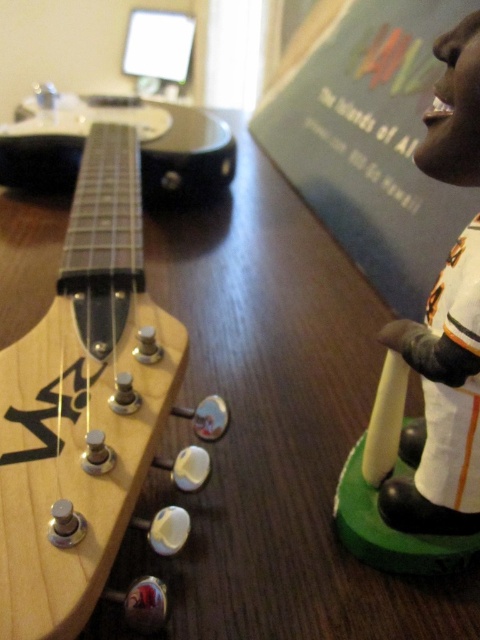
Question: Is the position of natural wood guitar headstock at center-left less distant than that of white plastic bobblehead at right?

Choices:
 (A) no
 (B) yes

Answer: (B)

Question: Is the position of natural wood guitar headstock at center-left more distant than that of white plastic bobblehead at right?

Choices:
 (A) no
 (B) yes

Answer: (A)

Question: Is natural wood guitar headstock at center-left below white plastic bobblehead at right?

Choices:
 (A) yes
 (B) no

Answer: (B)

Question: Which of the following is the farthest from the observer?

Choices:
 (A) white plastic bobblehead at right
 (B) natural wood guitar headstock at center-left

Answer: (A)

Question: Which point is closer to the camera taking this photo?

Choices:
 (A) (447, 474)
 (B) (82, 355)

Answer: (A)